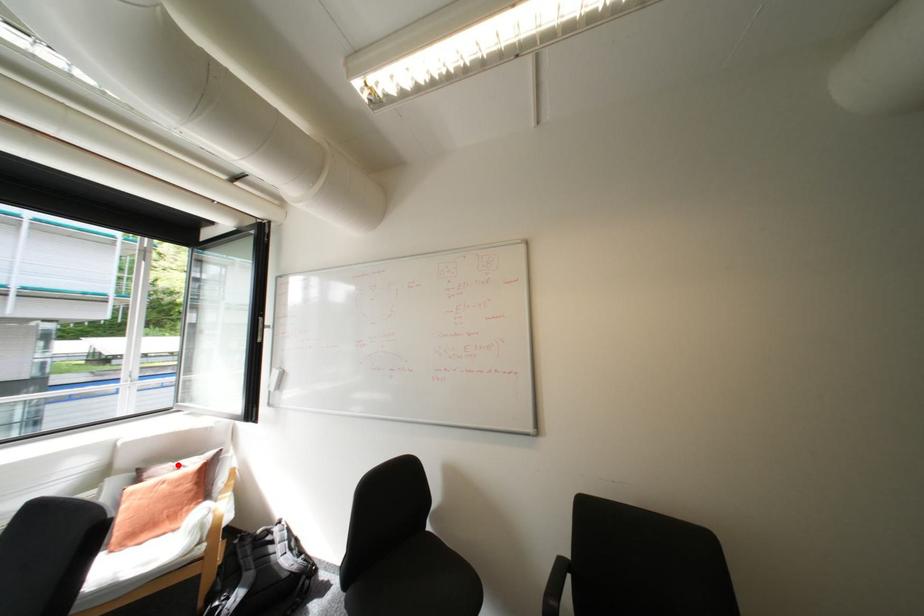
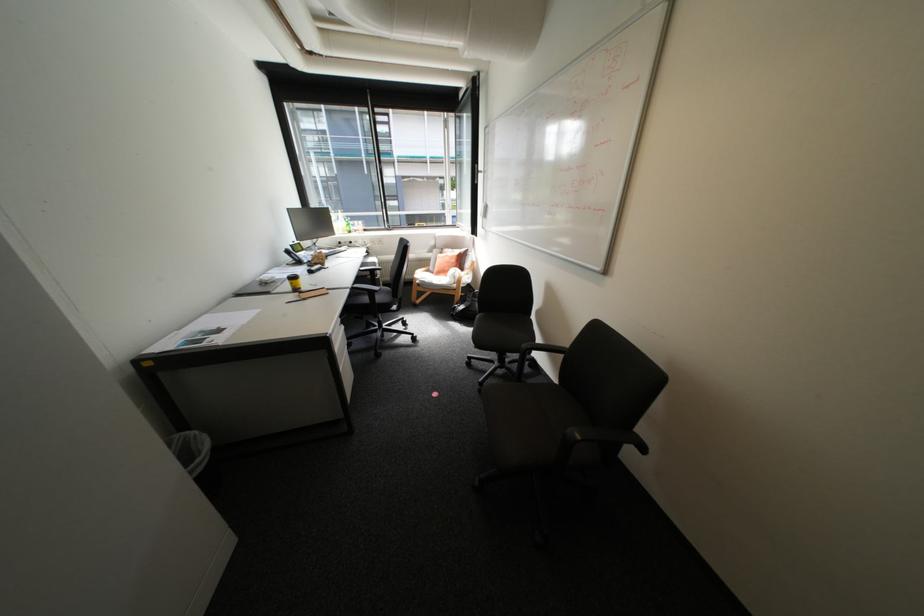
Question: I am providing you with two images of the same scene from different viewpoints. A red point is marked on the first image. Can you still see the location of the red point in image 2?

Choices:
 (A) Yes
 (B) No

Answer: (A)